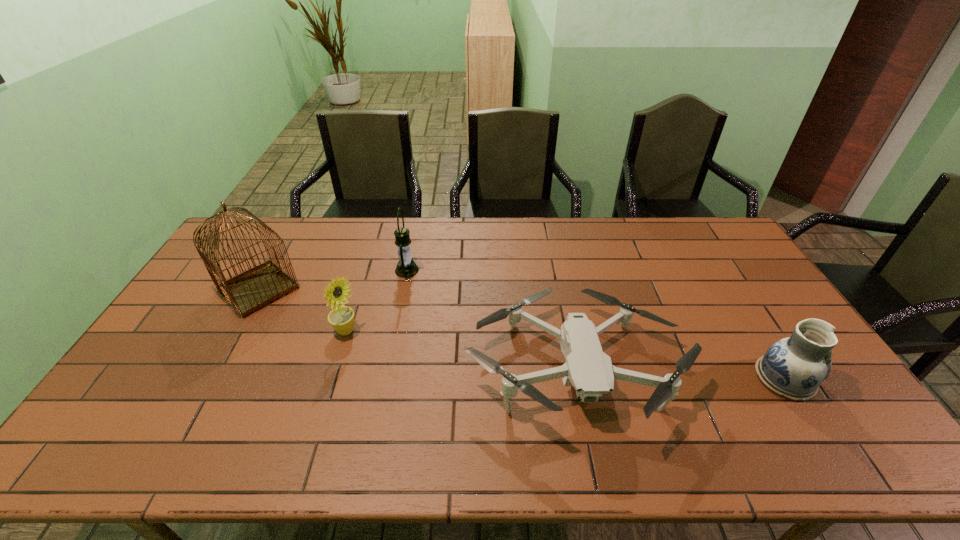
What are the coordinates of `free space located on the face of the sunflower` in the screenshot? It's located at (450, 332).

In order to click on free space located 0.320m on the back of the rightmost object in this screenshot , I will do pos(724,281).

The width and height of the screenshot is (960, 540). What are the coordinates of `object that is positioned at the near edge` in the screenshot? It's located at (588, 369).

This screenshot has width=960, height=540. I want to click on object that is at the left edge, so click(256, 288).

This screenshot has width=960, height=540. I want to click on object situated at the right edge, so click(x=794, y=367).

Image resolution: width=960 pixels, height=540 pixels. Find the location of `blank space at the far edge of the desktop`. blank space at the far edge of the desktop is located at coordinates tap(619, 236).

I want to click on free space at the near edge of the desktop, so click(x=698, y=458).

This screenshot has width=960, height=540. What are the coordinates of `free region at the far left corner of the desktop` in the screenshot? It's located at (259, 239).

Image resolution: width=960 pixels, height=540 pixels. What are the coordinates of `free spot between the birdcage and the drone` in the screenshot? It's located at (416, 328).

Identify the location of free space between the pottery and the lantern. (596, 324).